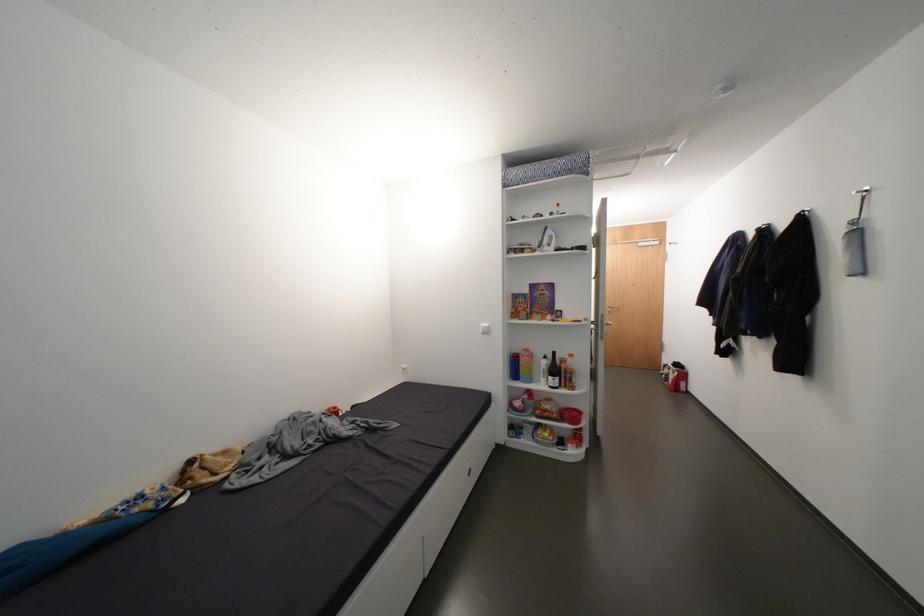
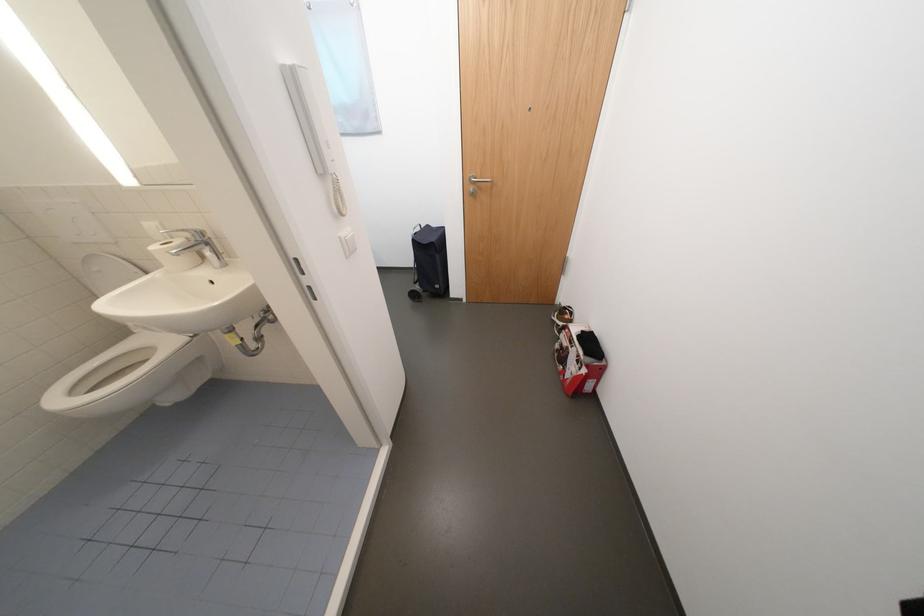
The point at (x=684, y=374) is marked in the first image. Where is the corresponding point in the second image?

(592, 371)